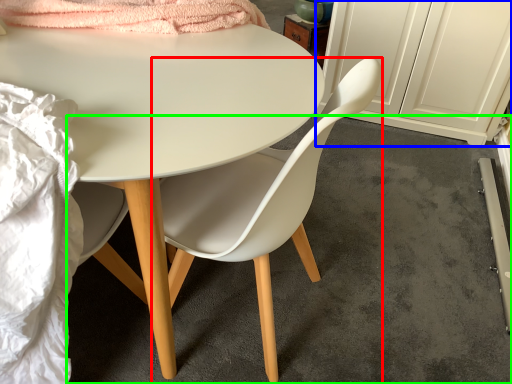
Question: Considering the real-world distances, which object is farthest from chair (highlighted by a red box)? cabinetry (highlighted by a blue box) or concrete (highlighted by a green box)?

Choices:
 (A) cabinetry
 (B) concrete

Answer: (A)